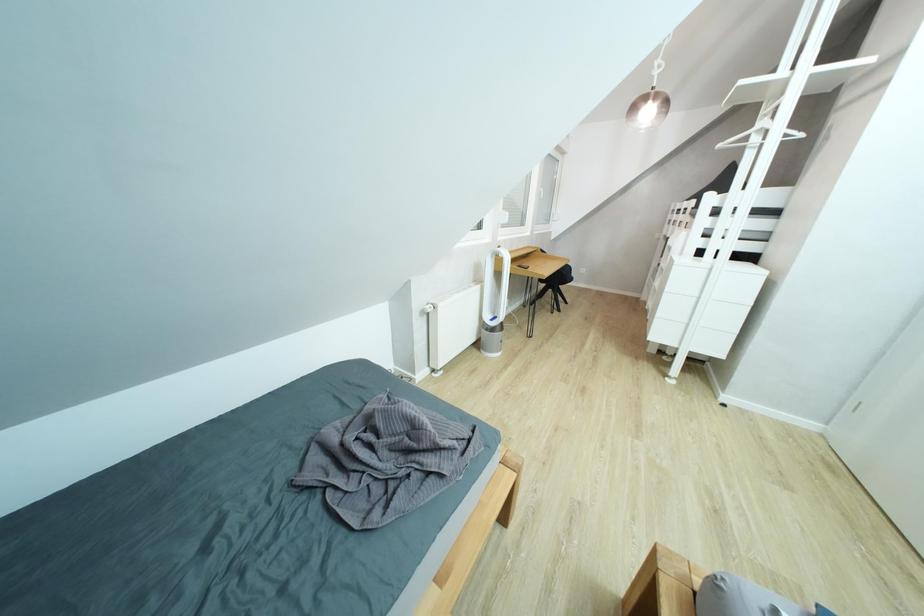
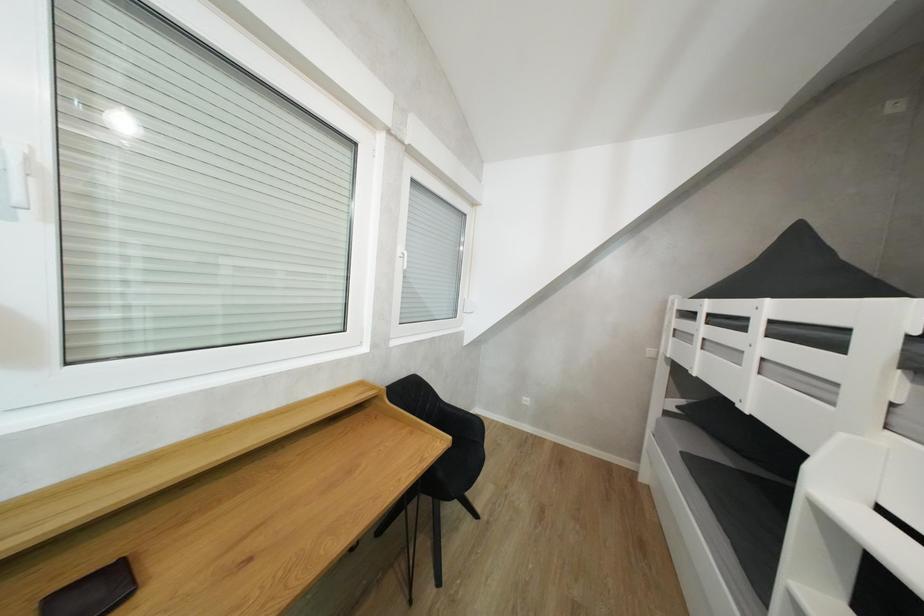
The images are taken continuously from a first-person perspective. In which direction are you moving?

The movement direction of the cameraman is right, forward.